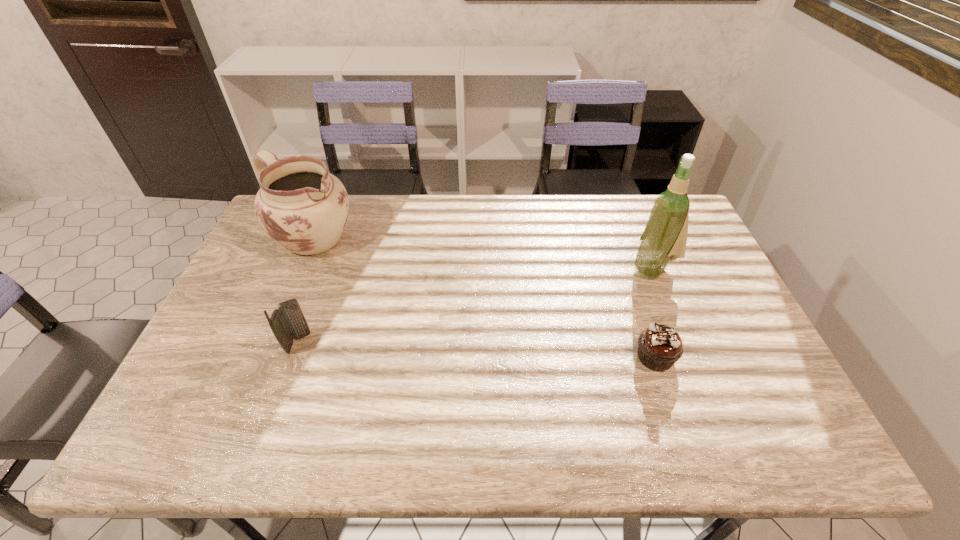
Choose which object is the nearest neighbor to the tallest object. Please provide its 2D coordinates. Your answer should be formatted as a tuple, i.e. [(x, y)], where the tuple contains the x and y coordinates of a point satisfying the conditions above.

[(659, 346)]

Where is `the third closest object to the wine bottle`? This screenshot has width=960, height=540. the third closest object to the wine bottle is located at coordinates (287, 322).

This screenshot has width=960, height=540. In order to click on free point that satisfies the following two spatial constraints: 1. on the front side of the second tallest object; 2. on the right side of the cupcake in this screenshot , I will do `click(261, 357)`.

At what (x,y) coordinates should I click in order to perform the action: click on free spot that satisfies the following two spatial constraints: 1. on the front side of the third tallest object; 2. on the keyboard of the pitcher. Please return your answer as a coordinate pair (x, y). The width and height of the screenshot is (960, 540). Looking at the image, I should click on (268, 343).

Find the location of `vacant space that satisfies the following two spatial constraints: 1. on the front side of the third shortest object; 2. on the keyboard of the second shortest object`. vacant space that satisfies the following two spatial constraints: 1. on the front side of the third shortest object; 2. on the keyboard of the second shortest object is located at coordinates (268, 343).

The width and height of the screenshot is (960, 540). Find the location of `free region that satisfies the following two spatial constraints: 1. on the front side of the pitcher; 2. on the keyboard of the second shortest object`. free region that satisfies the following two spatial constraints: 1. on the front side of the pitcher; 2. on the keyboard of the second shortest object is located at coordinates (268, 343).